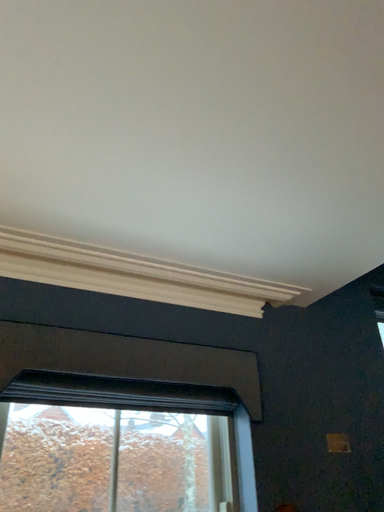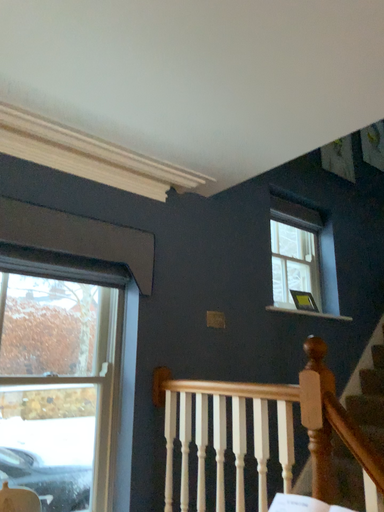
Question: Which way did the camera rotate in the video?

Choices:
 (A) rotated right
 (B) rotated left

Answer: (A)